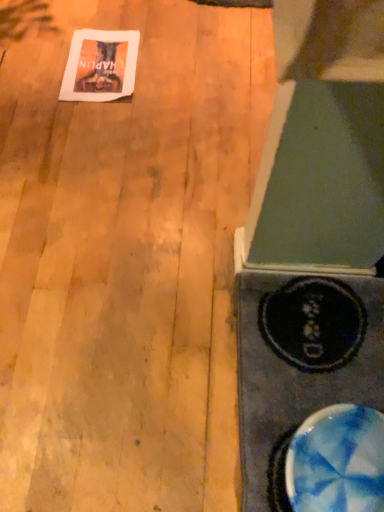
Question: Would you say white paper at upper left is part of blue marbled bowl at lower right's contents?

Choices:
 (A) yes
 (B) no

Answer: (B)

Question: Can you confirm if blue marbled bowl at lower right is positioned to the right of white paper at upper left?

Choices:
 (A) yes
 (B) no

Answer: (A)

Question: From the image's perspective, does blue marbled bowl at lower right appear higher than white paper at upper left?

Choices:
 (A) yes
 (B) no

Answer: (B)

Question: Is blue marbled bowl at lower right positioned with its back to white paper at upper left?

Choices:
 (A) no
 (B) yes

Answer: (A)

Question: Considering the relative positions of blue marbled bowl at lower right and white paper at upper left in the image provided, is blue marbled bowl at lower right to the left of white paper at upper left from the viewer's perspective?

Choices:
 (A) yes
 (B) no

Answer: (B)

Question: Is blue marbled bowl at lower right not close to white paper at upper left?

Choices:
 (A) no
 (B) yes

Answer: (B)

Question: Considering the relative sizes of wooden floor at upper left and white paper at upper left in the image provided, is wooden floor at upper left thinner than white paper at upper left?

Choices:
 (A) no
 (B) yes

Answer: (A)

Question: Is wooden floor at upper left positioned far away from white paper at upper left?

Choices:
 (A) yes
 (B) no

Answer: (B)

Question: Considering the relative sizes of wooden floor at upper left and white paper at upper left in the image provided, is wooden floor at upper left smaller than white paper at upper left?

Choices:
 (A) yes
 (B) no

Answer: (B)

Question: Could you tell me if wooden floor at upper left is turned towards white paper at upper left?

Choices:
 (A) no
 (B) yes

Answer: (A)

Question: Is wooden floor at upper left positioned beyond the bounds of white paper at upper left?

Choices:
 (A) yes
 (B) no

Answer: (A)

Question: Is white paper at upper left inside wooden floor at upper left?

Choices:
 (A) no
 (B) yes

Answer: (B)

Question: Is wooden floor at upper left surrounded by white paper at upper left?

Choices:
 (A) no
 (B) yes

Answer: (A)